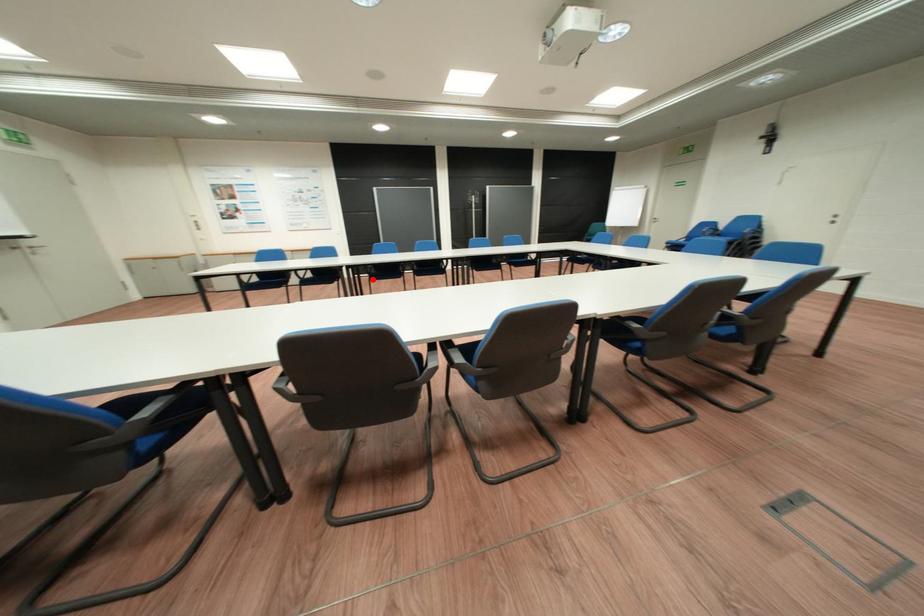
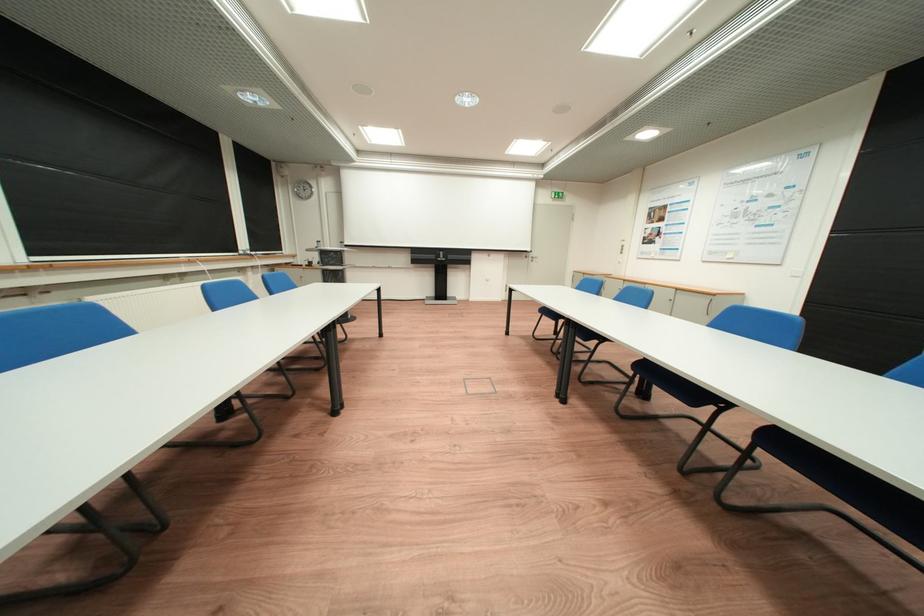
Question: I am providing you with two images of the same scene from different viewpoints. A red point is marked on the first image. Can you still see the location of the red point in image 2?

Choices:
 (A) Yes
 (B) No

Answer: (B)